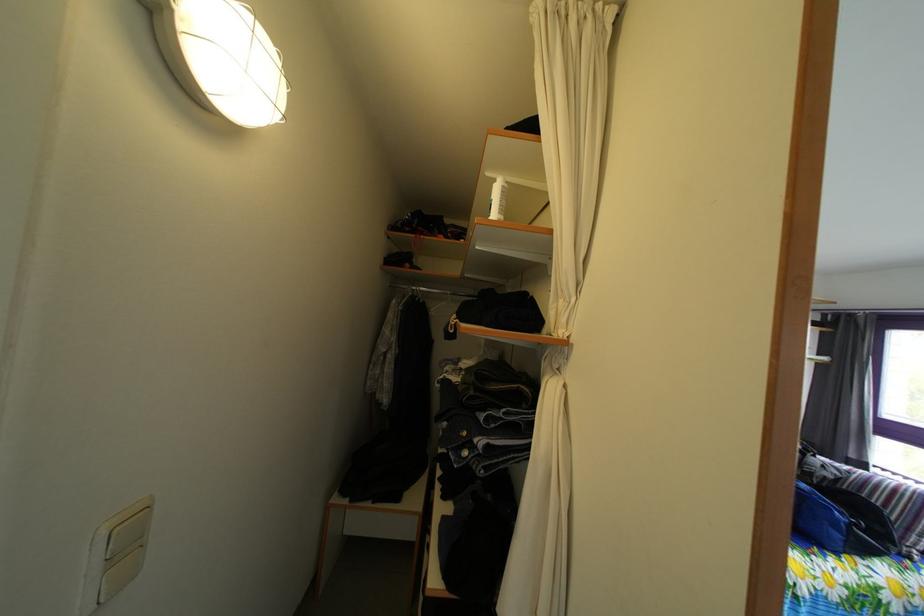
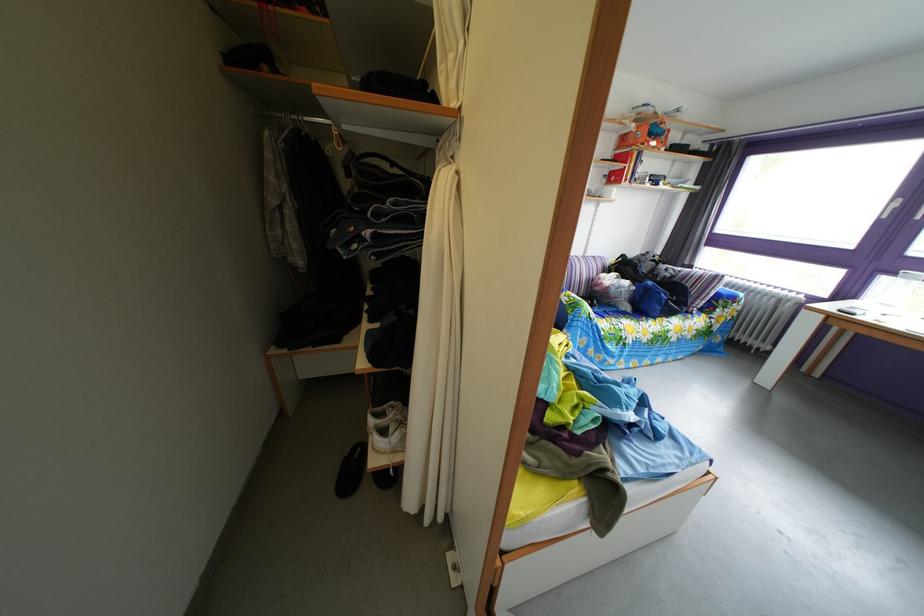
In the second image, find the point that corresponds to (545,416) in the first image.

(438, 207)